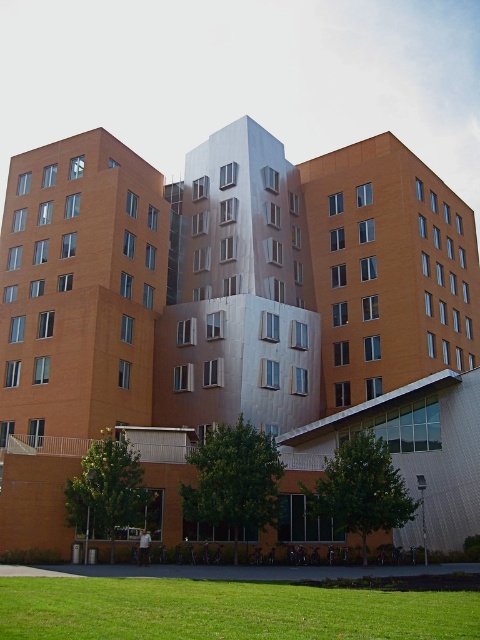
Question: Which point is closer to the camera taking this photo?

Choices:
 (A) (210, 141)
 (B) (66, 598)

Answer: (B)

Question: Considering the relative positions of matte orange building at center and green grass at lower center in the image provided, where is matte orange building at center located with respect to green grass at lower center?

Choices:
 (A) right
 (B) left

Answer: (A)

Question: Can you confirm if matte orange building at center is smaller than green grass at lower center?

Choices:
 (A) no
 (B) yes

Answer: (A)

Question: In this image, where is matte orange building at center located relative to green grass at lower center?

Choices:
 (A) right
 (B) left

Answer: (A)